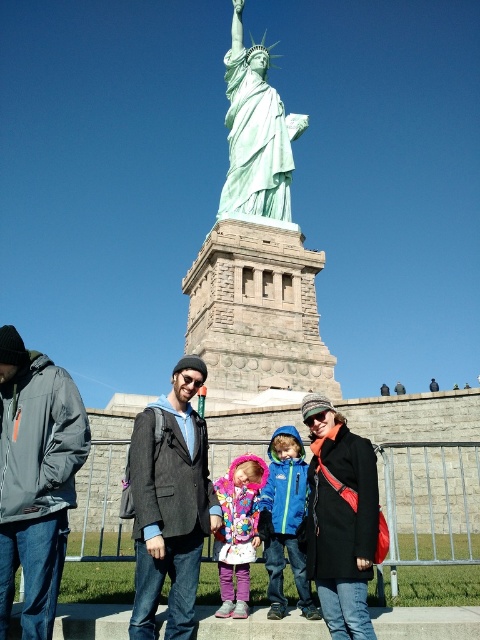
Question: Does gray softshell jacket at left have a smaller size compared to dark gray woolen jacket at center?

Choices:
 (A) no
 (B) yes

Answer: (B)

Question: Which object is closer to the camera taking this photo?

Choices:
 (A) black wool coat at center
 (B) green patina statue at center
 (C) dark gray woolen jacket at center
 (D) gray softshell jacket at left

Answer: (D)

Question: Which point is farther to the camera?

Choices:
 (A) dark gray woolen jacket at center
 (B) green patina statue at center

Answer: (B)

Question: Is blue fleece jacket at center closer to camera compared to fluffy fleece jacket at center?

Choices:
 (A) no
 (B) yes

Answer: (B)

Question: Does green patina statue at center have a lesser width compared to blue fleece jacket at center?

Choices:
 (A) no
 (B) yes

Answer: (A)

Question: Which point is closer to the camera taking this photo?

Choices:
 (A) (220, 540)
 (B) (227, 172)
 (C) (301, 502)
 (D) (24, 388)

Answer: (D)